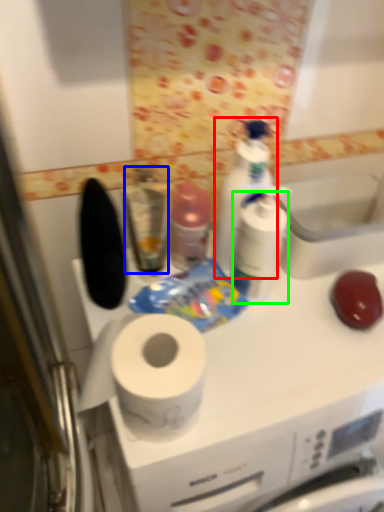
Question: Which object is positioned closest to cleaning product (highlighted by a red box)? Select from mouthwash (highlighted by a blue box) and toiletry (highlighted by a green box).

Choices:
 (A) mouthwash
 (B) toiletry

Answer: (B)